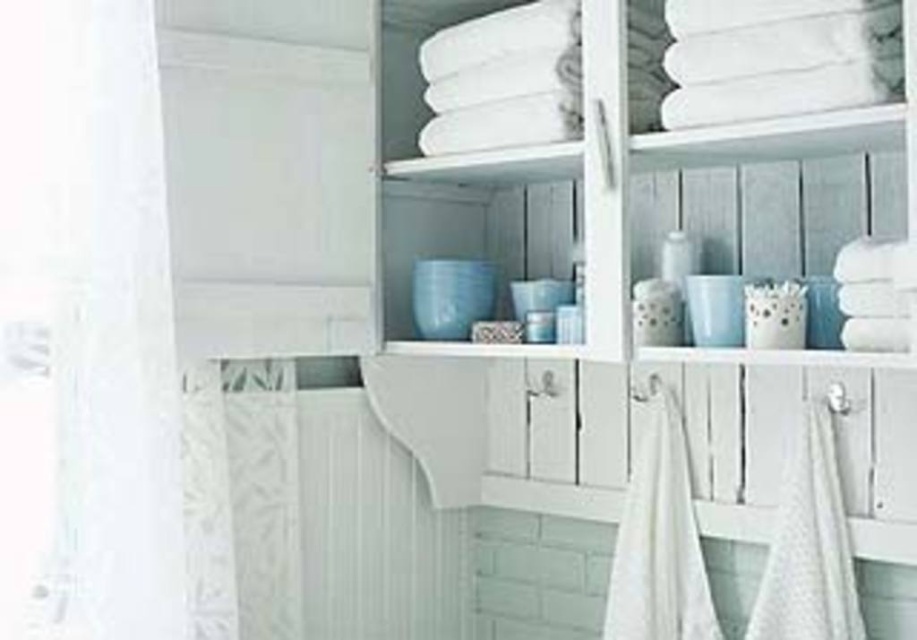
Question: Which point is farther to the camera?

Choices:
 (A) (757, 621)
 (B) (650, 524)
 (C) (112, 560)

Answer: (B)

Question: Estimate the real-world distances between objects in this image. Which object is farther from the white cotton towel at center?

Choices:
 (A) white sheer curtain at left
 (B) white textured towel at lower right

Answer: (A)

Question: Does white sheer curtain at left appear on the right side of white cotton towel at center?

Choices:
 (A) yes
 (B) no

Answer: (B)

Question: Does white sheer curtain at left appear on the right side of white textured towel at lower right?

Choices:
 (A) yes
 (B) no

Answer: (B)

Question: Which point appears closest to the camera in this image?

Choices:
 (A) (163, 516)
 (B) (655, 451)
 (C) (815, 563)

Answer: (C)

Question: Does white sheer curtain at left appear on the right side of white cotton towel at center?

Choices:
 (A) no
 (B) yes

Answer: (A)